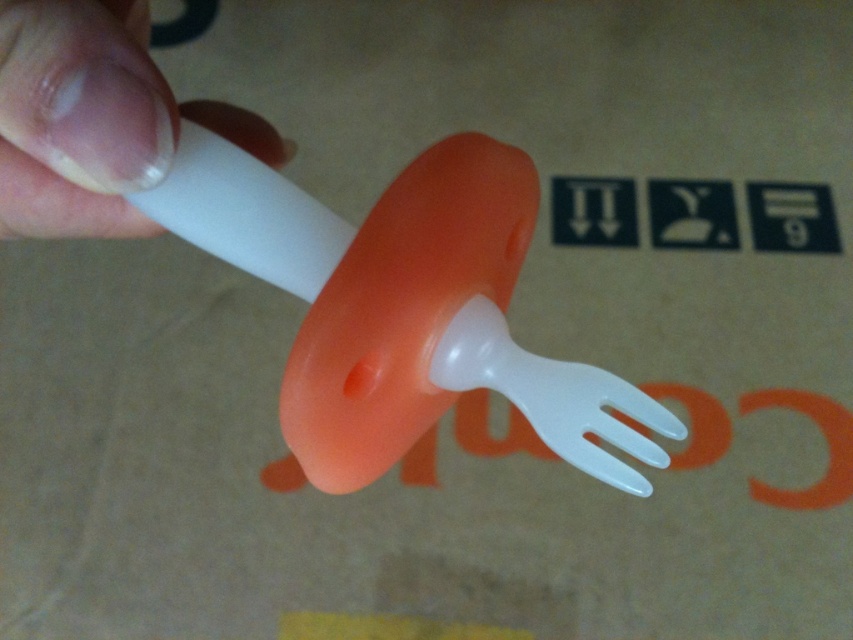
Question: Does translucent plastic fork at center have a smaller size compared to white matte plastic at upper left?

Choices:
 (A) yes
 (B) no

Answer: (B)

Question: Which point is closer to the camera?

Choices:
 (A) (15, 49)
 (B) (293, 428)

Answer: (A)

Question: Observing the image, what is the correct spatial positioning of translucent plastic fork at center in reference to white matte plastic at upper left?

Choices:
 (A) below
 (B) above

Answer: (A)

Question: Which point is farther from the camera taking this photo?

Choices:
 (A) (434, 349)
 (B) (148, 77)

Answer: (A)

Question: Does translucent plastic fork at center have a lesser width compared to white matte plastic at upper left?

Choices:
 (A) no
 (B) yes

Answer: (A)